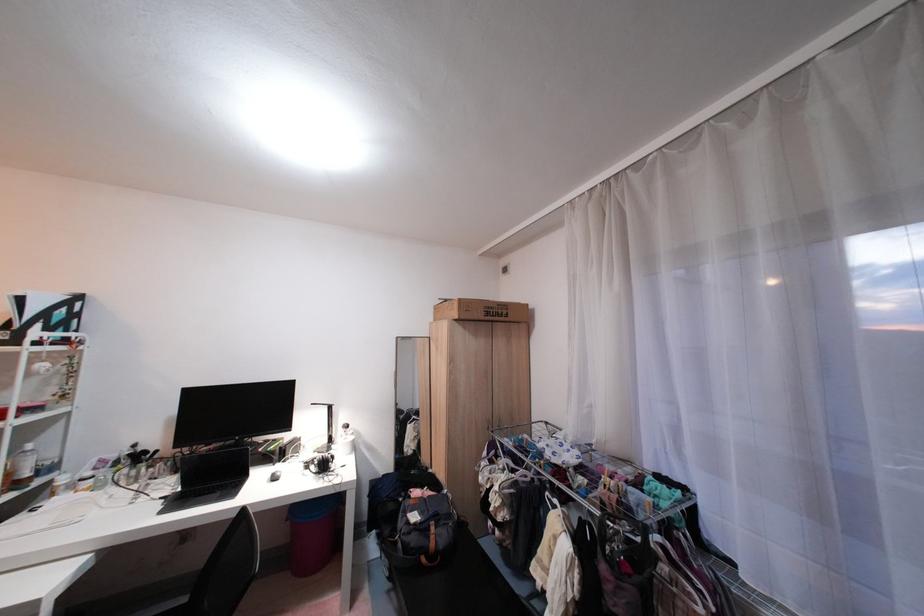
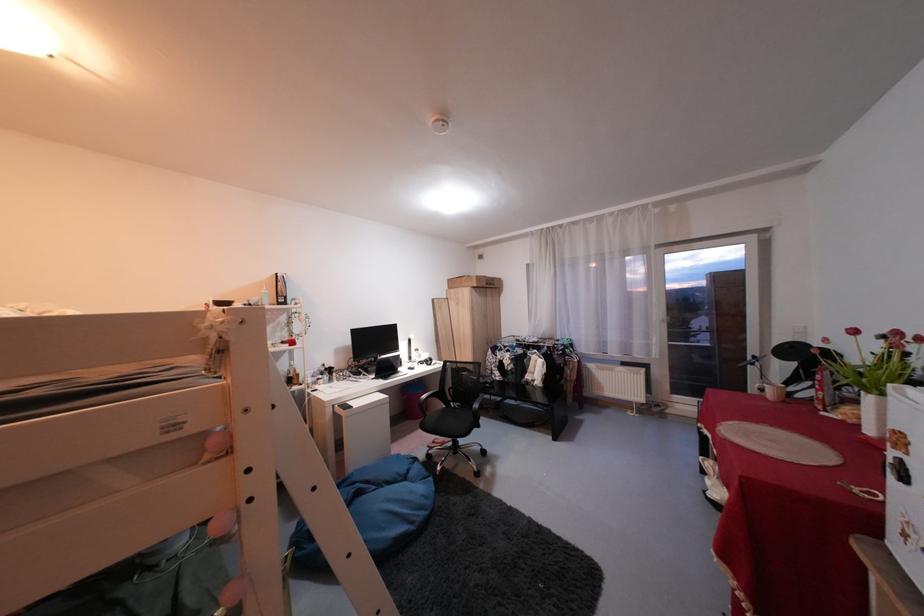
Consider the image. The images are taken continuously from a first-person perspective. In which direction are you moving?

The movement direction of the cameraman is left, backward.